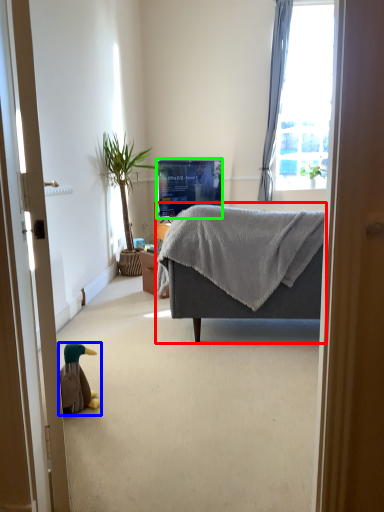
Question: Considering the real-world distances, which object is closest to studio couch (highlighted by a red box)? animal (highlighted by a blue box) or television (highlighted by a green box).

Choices:
 (A) animal
 (B) television

Answer: (A)